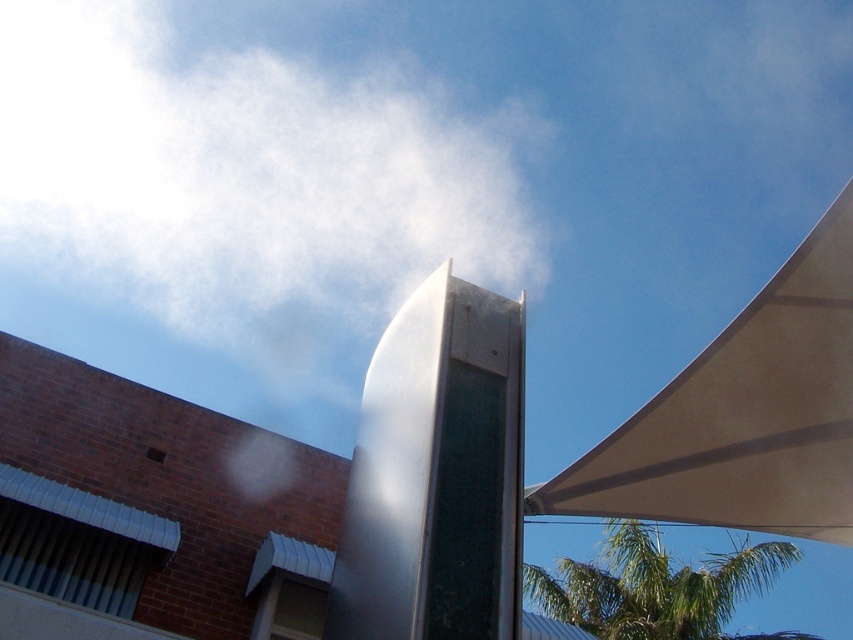
You are standing in the scene and want to place a small potted plant between the beige fabric canopy at upper right and the green leafy palm tree at upper right. Based on their positions, which object should the plant be closer to?

The beige fabric canopy at upper right is to the left of the green leafy palm tree at upper right, so placing the plant between them would require positioning it closer to the beige fabric canopy at upper right since it is already on the left side.

Looking at this image, you are standing at the center of the image. Which direction should you look to see the beige fabric canopy at upper right represented by point [743,416]?

The beige fabric canopy at upper right represented by point [743,416] is located at the upper right of the image, so you should look towards the upper right direction to see it.

You are planning to install a new lighting fixture that needs to be placed above the green leafy palm tree at upper right. Considering the beige fabric canopy at upper right, will the canopy block the light from reaching the palm tree?

The beige fabric canopy at upper right is much taller than the green leafy palm tree at upper right, so it will block the light from reaching the palm tree.